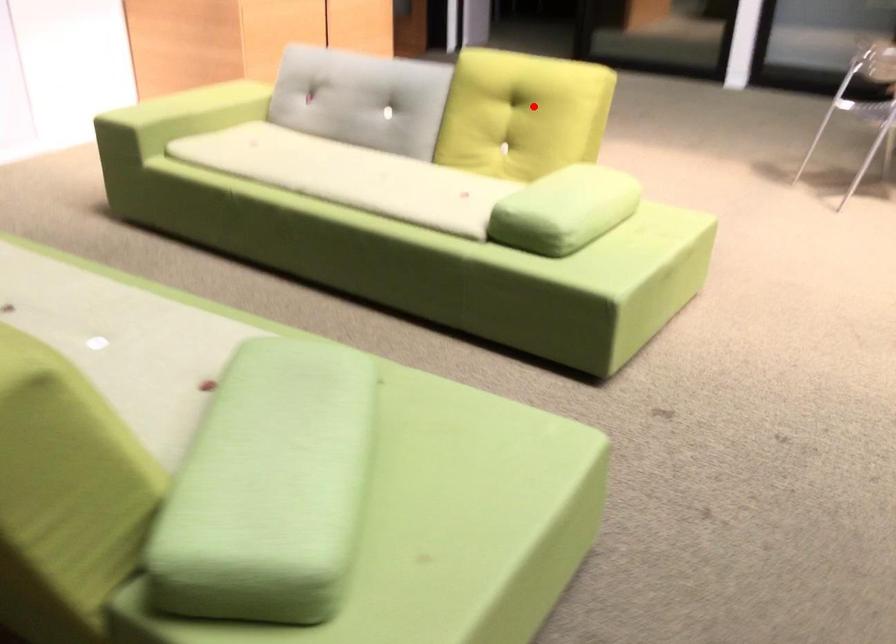
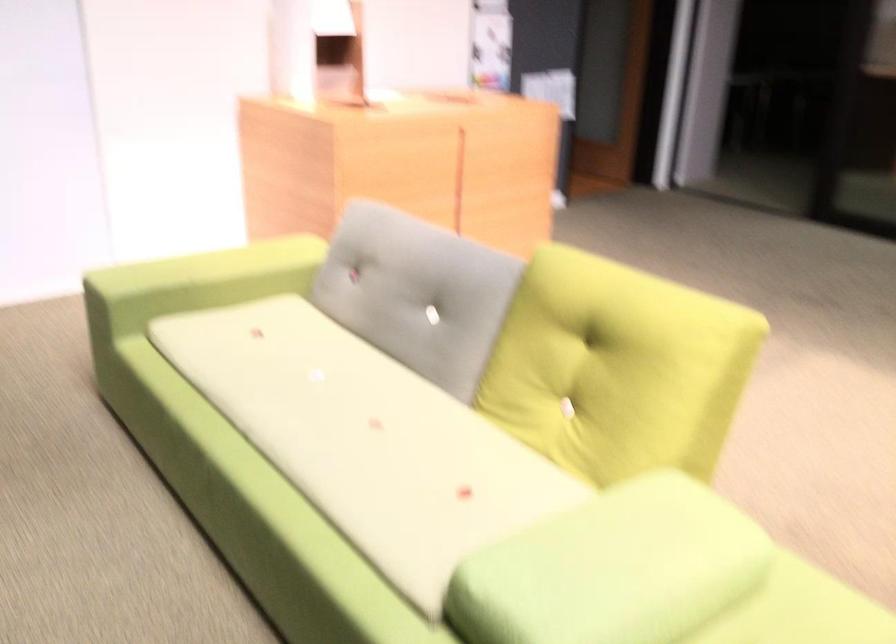
The point at the highlighted location is marked in the first image. Where is the corresponding point in the second image?

(616, 368)